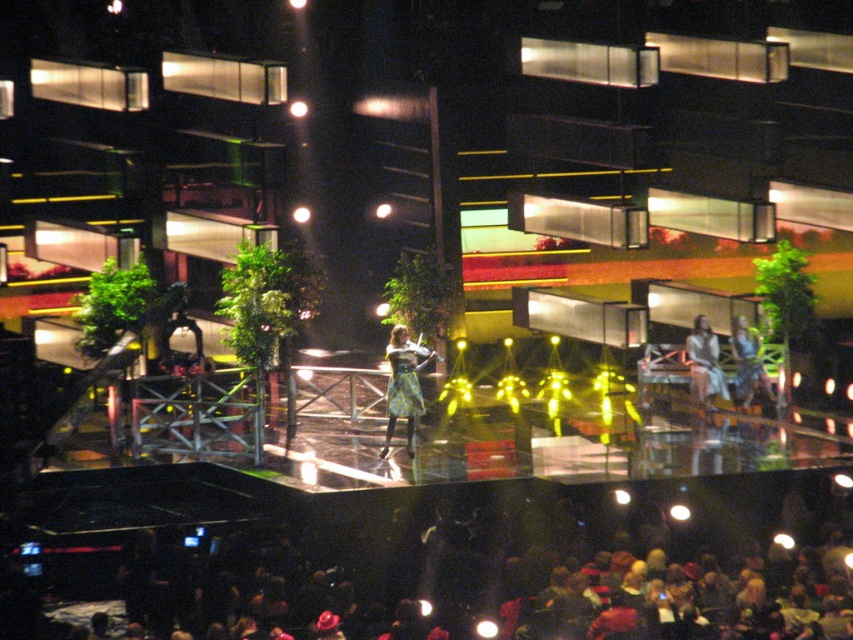
You are a photographer positioned at the back of the venue. You want to take a photo that includes both the light brown leather jacket at center and the floral dress at center. Based on their positions, which object should you adjust your camera to focus on first to ensure both are in frame?

The light brown leather jacket at center is to the left of the floral dress at center. To include both in the frame, focus on the light brown leather jacket at center first since it is positioned further left, ensuring the floral dress at center remains within the camera range.

You are a photographer positioned at the back of the venue, aiming to capture a clear shot of the floral dress at center without the light brown leather jacket at center obstructing it. Is this possible given their positions?

The light brown leather jacket at center is in front of the floral dress at center, so it will block the view. To capture the floral dress at center clearly, you need to move to a position where the light brown leather jacket at center is not between you and the floral dress at center.